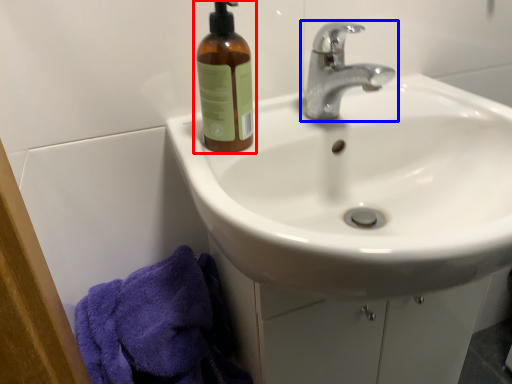
Question: Which point is further to the camera, bottle (highlighted by a red box) or tap (highlighted by a blue box)?

Choices:
 (A) bottle
 (B) tap

Answer: (A)